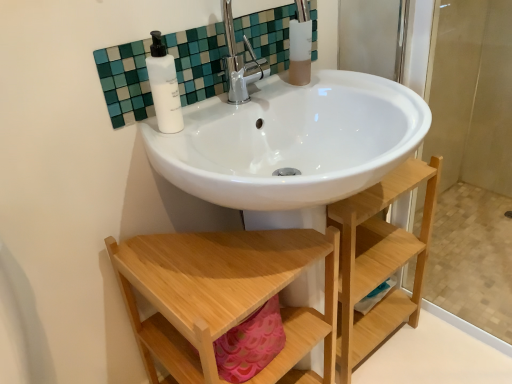
Locate an element on the screen. Image resolution: width=512 pixels, height=384 pixels. vacant space in between translucent frosted glass cup at upper center and white matte bottle at upper center is located at coordinates (244, 104).